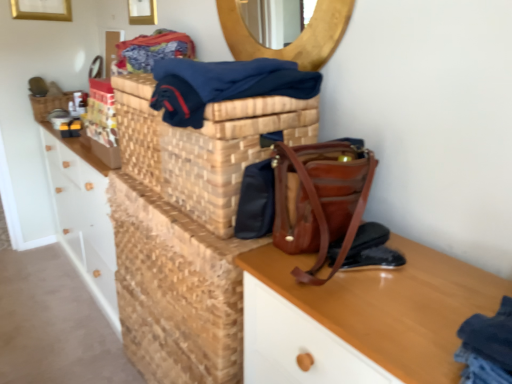
Find the location of `vacant area that is in front of black leather shoe at lower right, the 2th shoe viewed from the top`. vacant area that is in front of black leather shoe at lower right, the 2th shoe viewed from the top is located at coordinates (386, 304).